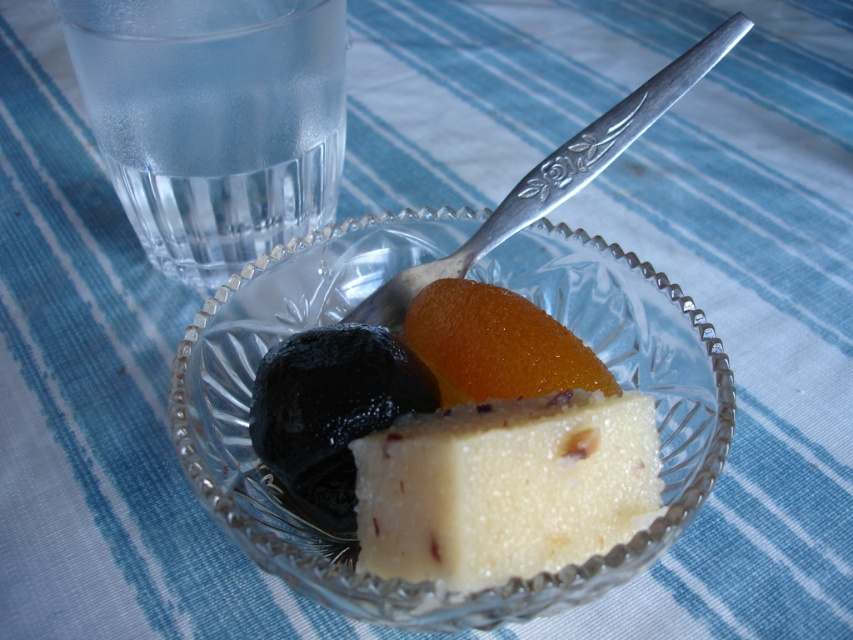
Question: Is white crumbly cheese at center above polished silver spoon at upper center?

Choices:
 (A) yes
 (B) no

Answer: (B)

Question: In this image, where is clear crystal bowl at center located relative to polished silver spoon at upper center?

Choices:
 (A) left
 (B) right

Answer: (A)

Question: Which point is closer to the camera?

Choices:
 (A) white crumbly cheese at center
 (B) clear crystal bowl at center
 (C) transparent glass water at upper left

Answer: (B)

Question: Is white crumbly cheese at center to the left of glossy orange fruit at center from the viewer's perspective?

Choices:
 (A) yes
 (B) no

Answer: (B)

Question: Which of the following is the farthest from the observer?

Choices:
 (A) (653, 76)
 (B) (445, 353)

Answer: (A)

Question: Which object is closer to the camera taking this photo?

Choices:
 (A) transparent glass water at upper left
 (B) white crumbly cheese at center
 (C) polished silver spoon at upper center
 (D) clear crystal bowl at center

Answer: (D)